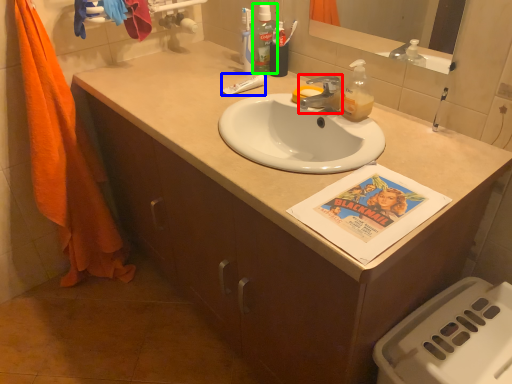
Question: Estimate the real-world distances between objects in this image. Which object is farther from faucet (highlighted by a red box), toothpaste (highlighted by a blue box) or mouthwash (highlighted by a green box)?

Choices:
 (A) toothpaste
 (B) mouthwash

Answer: (B)